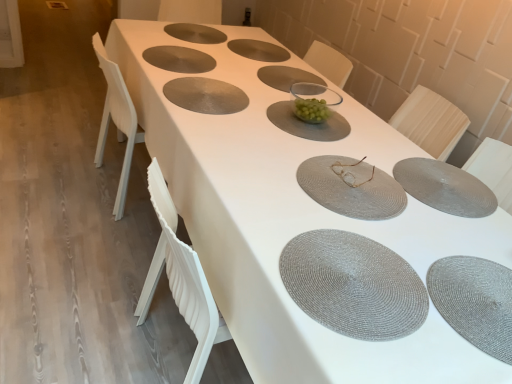
Identify the location of free space that is in between gray woven placemat at center and gray woven placemat at center, the 2th tableware in the bottom-to-top sequence. (296, 126).